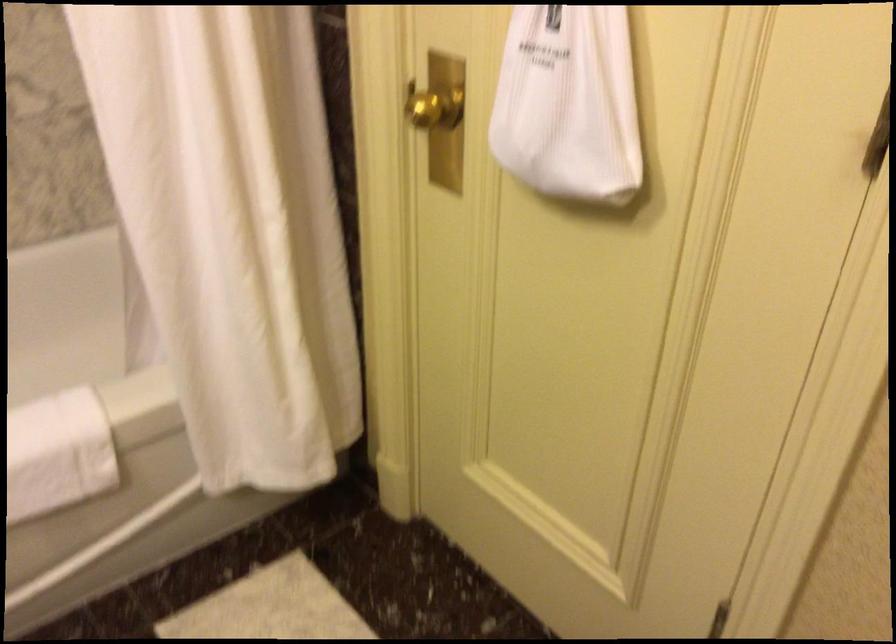
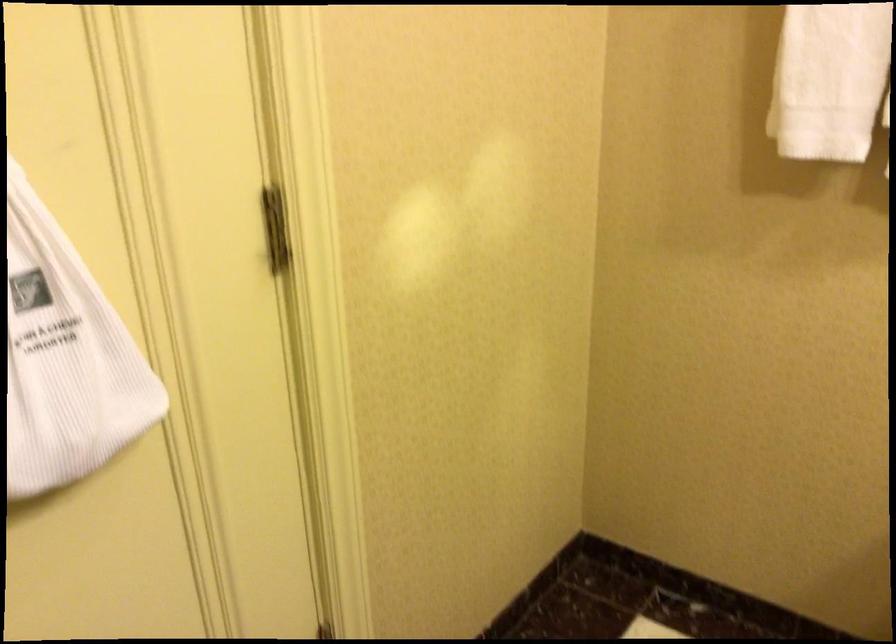
Where in the second image is the point corresponding to point (582, 84) from the first image?

(65, 357)